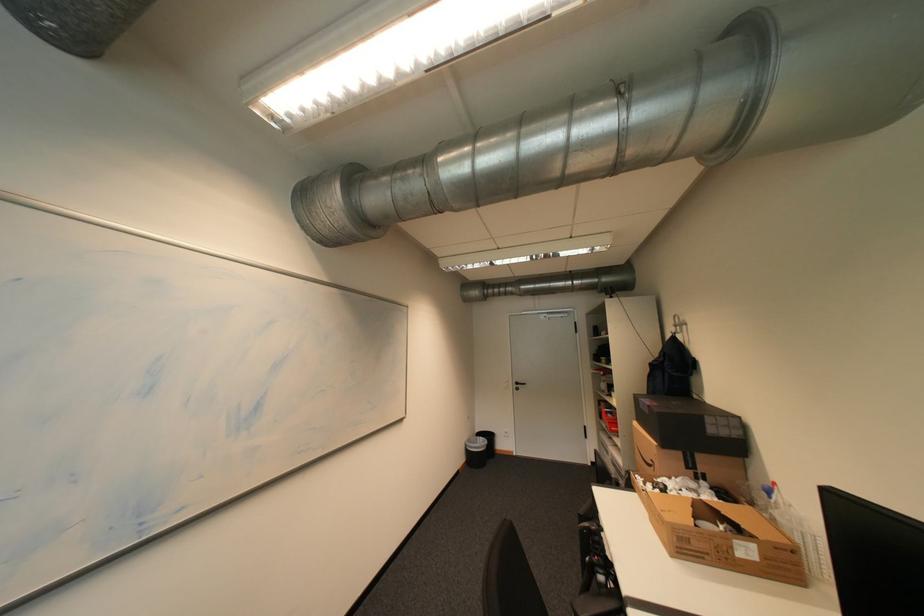
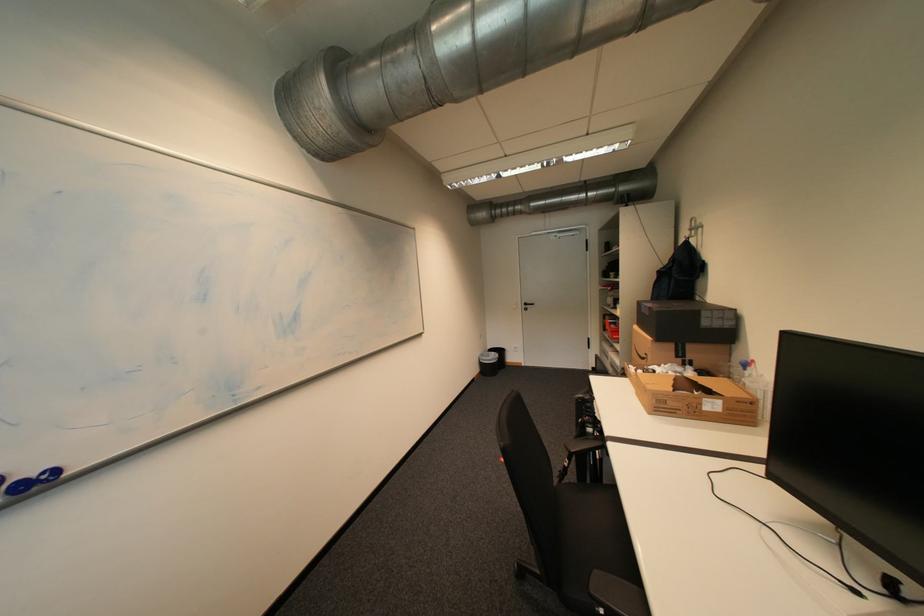
Question: The images are taken continuously from a first-person perspective. In which direction is your viewpoint rotating?

Choices:
 (A) Left
 (B) Right
 (C) Up
 (D) Down

Answer: (D)